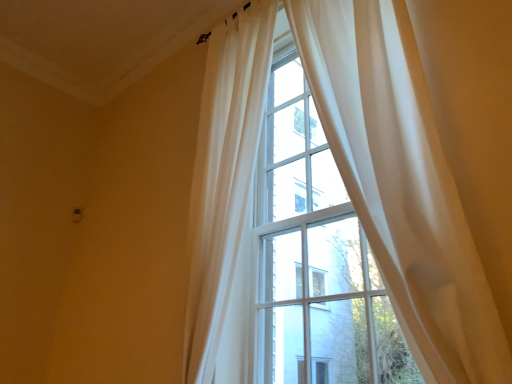
Question: In the image, is sheer white curtain at upper right, which is counted as the first curtain, starting from the right, on the left side or the right side of sheer white curtain at upper center, which is the second curtain from right to left?

Choices:
 (A) left
 (B) right

Answer: (B)

Question: Which is correct: sheer white curtain at upper right, which is the second curtain in left-to-right order, is inside sheer white curtain at upper center, arranged as the 1th curtain when viewed from the left, or outside of it?

Choices:
 (A) outside
 (B) inside

Answer: (A)

Question: In terms of size, does sheer white curtain at upper right, which is counted as the first curtain, starting from the right, appear bigger or smaller than sheer white curtain at upper center, which is the second curtain from right to left?

Choices:
 (A) small
 (B) big

Answer: (A)

Question: From a real-world perspective, is sheer white curtain at upper center, arranged as the 1th curtain when viewed from the left, physically located above or below sheer white curtain at upper right, which is counted as the first curtain, starting from the right?

Choices:
 (A) above
 (B) below

Answer: (A)

Question: In the image, is sheer white curtain at upper center, which is the second curtain from right to left, positioned in front of or behind sheer white curtain at upper right, which is counted as the first curtain, starting from the right?

Choices:
 (A) behind
 (B) front

Answer: (A)

Question: Considering the positions of sheer white curtain at upper center, which is the second curtain from right to left, and sheer white curtain at upper right, which is the second curtain in left-to-right order, in the image, is sheer white curtain at upper center, which is the second curtain from right to left, taller or shorter than sheer white curtain at upper right, which is the second curtain in left-to-right order,?

Choices:
 (A) short
 (B) tall

Answer: (B)

Question: Looking at their shapes, would you say sheer white curtain at upper center, arranged as the 1th curtain when viewed from the left, is wider or thinner than sheer white curtain at upper right, which is counted as the first curtain, starting from the right?

Choices:
 (A) thin
 (B) wide

Answer: (B)